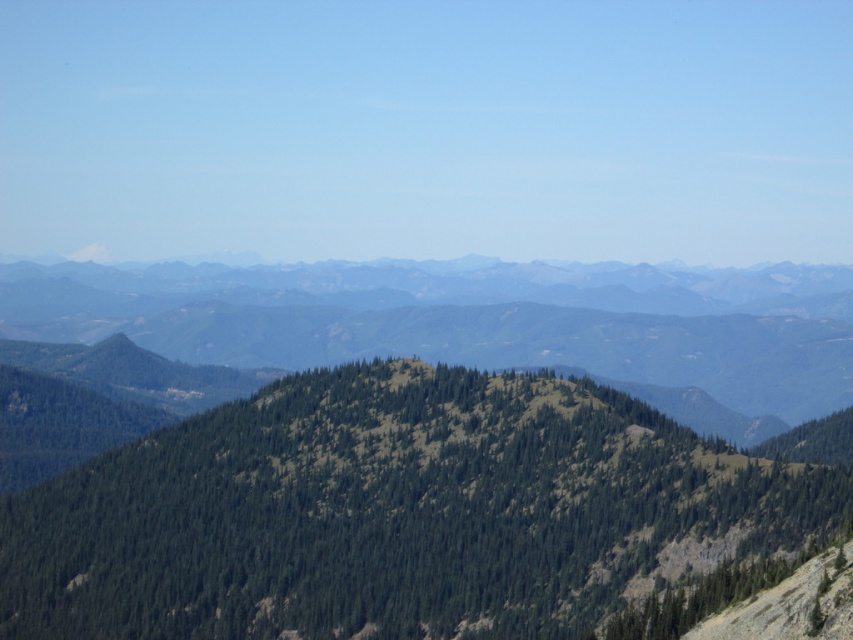
You are standing at the base of the mountain and looking at the landscape. There are two points marked in the image, point 1 at coordinates point (622,534) and point 2 at coordinates point (309,307). Which point is nearer to you?

Point (622,534) is closer to the viewer than point (309,307).

You are standing at the camera position and want to hike to the green textured mountain at center. If your average hiking pace is 3.5 km per hour, how long would it take you to reach the mountain?

The distance between you and the green textured mountain at center is 113.69 meters. Converting meters to kilometers, that is 0.11369 km. At a pace of 3.5 km per hour, the time required would be approximately 0.11369 km divided by 3.5 km per hour, which equals roughly 0.0325 hours. Multiplying by 60 minutes gives about 1.95 minutes. So, it would take approximately 2 minutes to reach the green textured mountain at center.